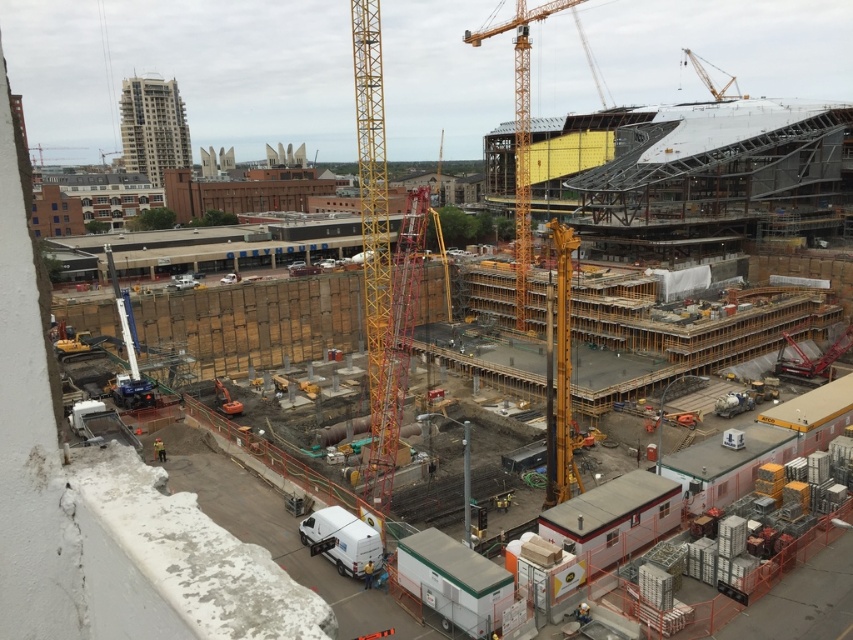
Looking at this image, between white matte van at lower center and metallic yellow crane at center, which one is positioned higher?

Positioned higher is metallic yellow crane at center.

Which is in front, point (338, 541) or point (796, 362)?

Positioned in front is point (338, 541).

At what (x,y) coordinates should I click in order to perform the action: click on white matte van at lower center. Please return your answer as a coordinate pair (x, y). Looking at the image, I should click on click(343, 540).

Can you confirm if wooden planks at center is thinner than yellow metallic crane at upper right?

Correct, wooden planks at center's width is less than yellow metallic crane at upper right's.

Does wooden planks at center have a lesser height compared to yellow metallic crane at upper right?

Indeed, wooden planks at center has a lesser height compared to yellow metallic crane at upper right.

At what (x,y) coordinates should I click in order to perform the action: click on wooden planks at center. Please return your answer as a coordinate pair (x, y). The image size is (853, 640). Looking at the image, I should click on (809, 268).

Based on the photo, which is below, metallic yellow crane at center or yellow metallic crane at upper right?

metallic yellow crane at center is lower down.

Can you confirm if metallic yellow crane at center is smaller than yellow metallic crane at upper right?

Yes, metallic yellow crane at center is smaller than yellow metallic crane at upper right.

The height and width of the screenshot is (640, 853). What do you see at coordinates (811, 358) in the screenshot? I see `metallic yellow crane at center` at bounding box center [811, 358].

You are a GUI agent. You are given a task and a screenshot of the screen. Output one action in this format:
    pyautogui.click(x=<x>, y=<y>)
    Task: Click on the metallic yellow crane at center
    This screenshot has height=640, width=853.
    Given the screenshot: What is the action you would take?
    pyautogui.click(x=811, y=358)